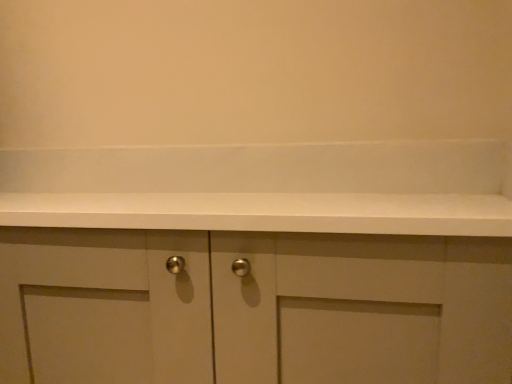
What do you see at coordinates (252, 307) in the screenshot?
I see `white matte cabinet doors at center` at bounding box center [252, 307].

I want to click on white matte cabinet doors at center, so click(x=252, y=307).

You are a GUI agent. You are given a task and a screenshot of the screen. Output one action in this format:
    pyautogui.click(x=<x>, y=<y>)
    Task: Click on the white matte cabinet doors at center
    
    Given the screenshot: What is the action you would take?
    pyautogui.click(x=252, y=307)